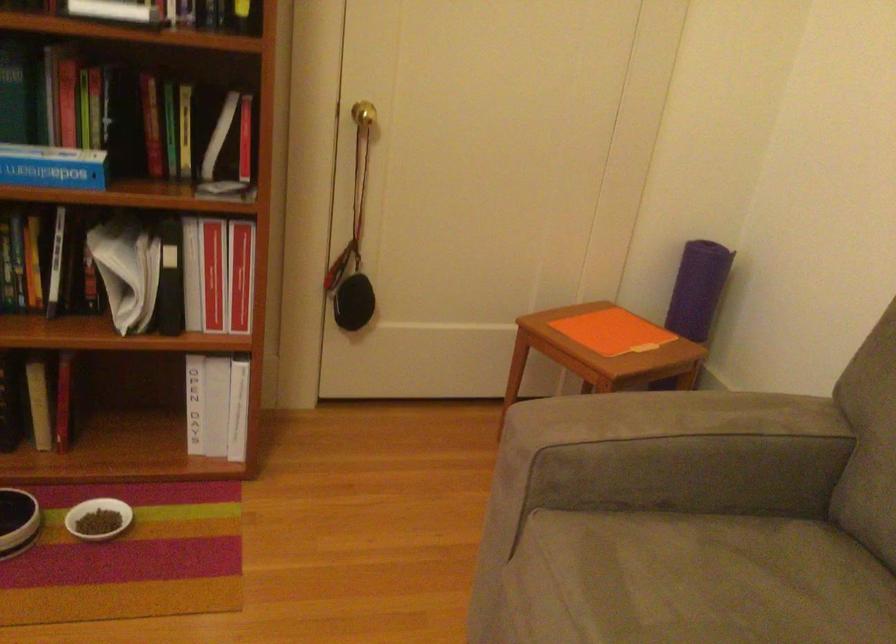
Find where to turn the brass door knob. Please return your answer as a coordinate pair (x, y).

(364, 114)